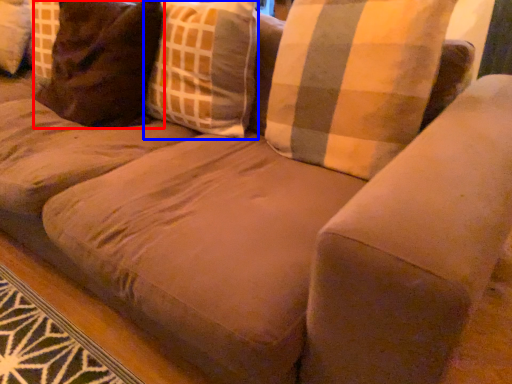
Question: Among these objects, which one is farthest to the camera, pillow (highlighted by a red box) or throw pillow (highlighted by a blue box)?

Choices:
 (A) pillow
 (B) throw pillow

Answer: (A)